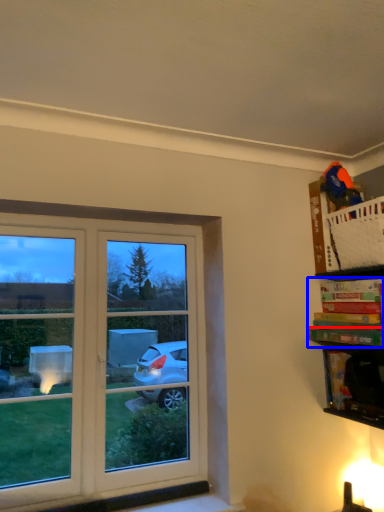
Question: Which object is further to the camera taking this photo, book (highlighted by a red box) or book (highlighted by a blue box)?

Choices:
 (A) book
 (B) book

Answer: (B)